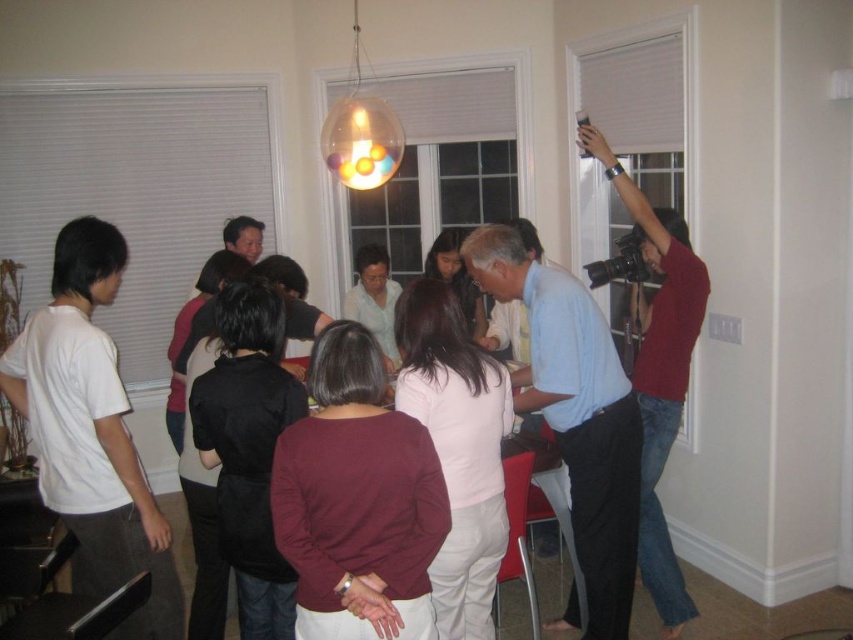
You are at a social gathering and want to take a photo of the burgundy fabric blouse at center without it being obstructed by the camera. Given that the camera is 6.17 feet away from the blouse, can you estimate if there is enough space between them to avoid obstruction?

The burgundy fabric blouse at center and the camera are 6.17 feet apart, so there is sufficient space between them to avoid obstruction when taking the photo.